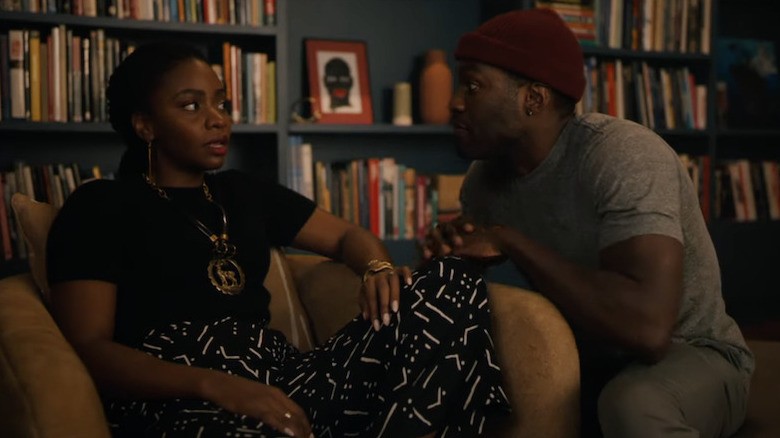
Identify the location of book. This screenshot has width=780, height=438. (396, 204).